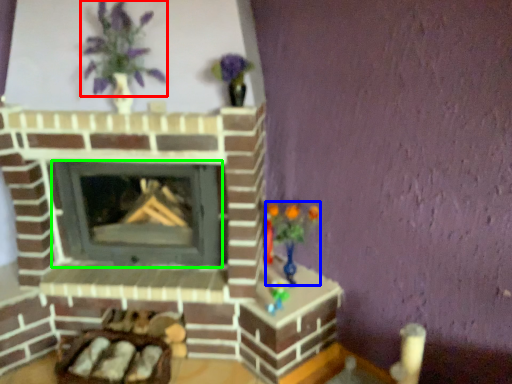
Question: Which object is positioned farthest from floral arrangement (highlighted by a red box)? Select from toy (highlighted by a blue box) and wood burning stove (highlighted by a green box).

Choices:
 (A) toy
 (B) wood burning stove

Answer: (A)